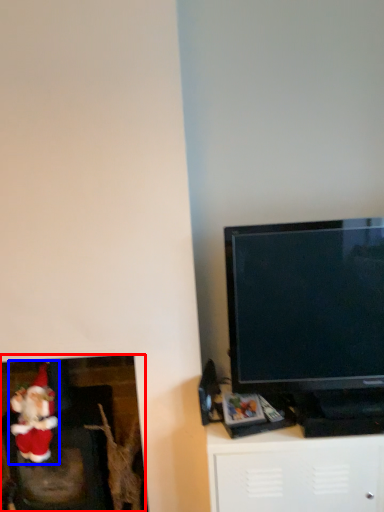
Question: Which of the following is the farthest to the observer, fireplace (highlighted by a red box) or santa claus (highlighted by a blue box)?

Choices:
 (A) fireplace
 (B) santa claus

Answer: (A)